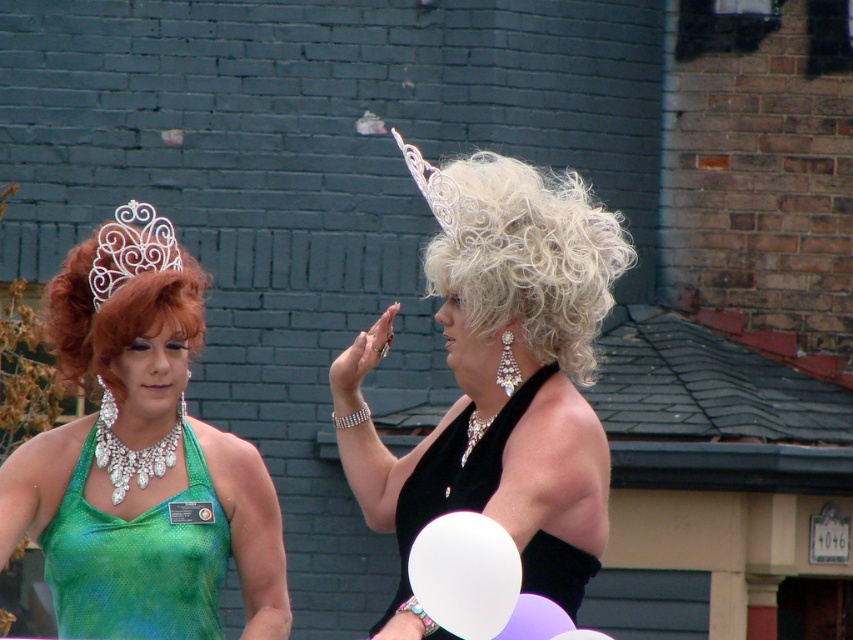
Between point (105, 515) and point (102, 451), which one is positioned behind?

The point (102, 451) is behind.

Who is shorter, green shiny dress at left or sparkling diamond necklace at center?

Standing shorter between the two is sparkling diamond necklace at center.

Does point (50, 532) come behind point (120, 499)?

No, (50, 532) is closer to viewer.

Find the location of `green shiny dress at left`. green shiny dress at left is located at coordinates [138, 560].

Between green sequined dress at left and purple matte balloon at center, which one appears on the left side from the viewer's perspective?

From the viewer's perspective, green sequined dress at left appears more on the left side.

Does point (196, 515) come behind point (581, 628)?

No.

Who is more forward, (123, 381) or (584, 634)?

Point (584, 634) is more forward.

Where is `green sequined dress at left`? The height and width of the screenshot is (640, 853). green sequined dress at left is located at coordinates (141, 458).

Does point (509, 624) come behind point (471, 412)?

That is False.

Does purple translucent balloon at center appear on the left side of silver metallic necklace at center?

In fact, purple translucent balloon at center is to the right of silver metallic necklace at center.

Where is `purple translucent balloon at center`? Image resolution: width=853 pixels, height=640 pixels. purple translucent balloon at center is located at coordinates (535, 620).

You are a GUI agent. You are given a task and a screenshot of the screen. Output one action in this format:
    pyautogui.click(x=<x>, y=<y>)
    Task: Click on the purple translucent balloon at center
    
    Given the screenshot: What is the action you would take?
    pyautogui.click(x=535, y=620)